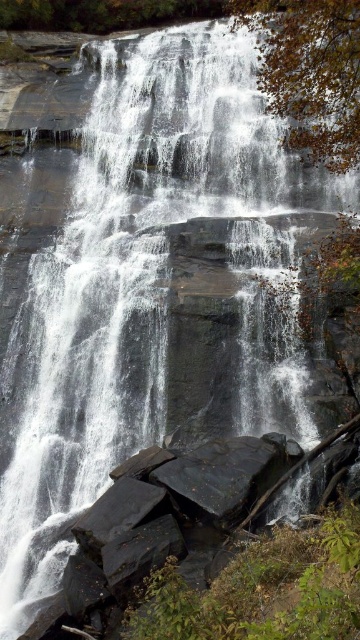
You are standing at the edge of the waterfall and notice a black smooth rock at center. Can you determine its exact location based on the coordinates provided?

The black smooth rock at center is located at point (222, 476) according to the coordinates provided.

You are standing at the base of the waterfall and notice two rocks in the foreground. One is the dark gray rock at lower center and the other is the black smooth rock at lower center. Which rock is positioned higher up relative to the other?

The dark gray rock at lower center is located below the black smooth rock at lower center, so the black smooth rock at lower center is positioned higher up.

You are a hiker who wants to cross the river near the waterfall. You notice two rocks in the water. The first is the black smooth rock at center, and the second is the black smooth rock at lower center. Which rock is larger and would provide a more stable stepping stone?

The black smooth rock at center is bigger than the black smooth rock at lower center, so it would provide a more stable stepping stone.